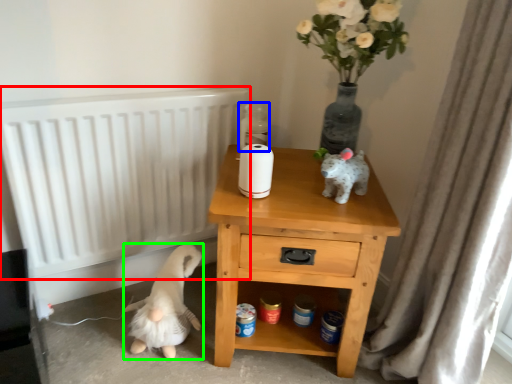
Question: Estimate the real-world distances between objects in this image. Which object is farther from radiator (highlighted by a red box), bottle (highlighted by a blue box) or animal (highlighted by a green box)?

Choices:
 (A) bottle
 (B) animal

Answer: (A)